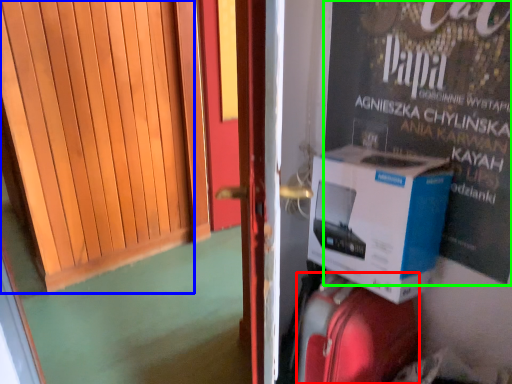
Question: Which object is positioned farthest from suitcase (highlighted by a red box)? Select from door (highlighted by a blue box) and advertisement (highlighted by a green box).

Choices:
 (A) door
 (B) advertisement

Answer: (A)